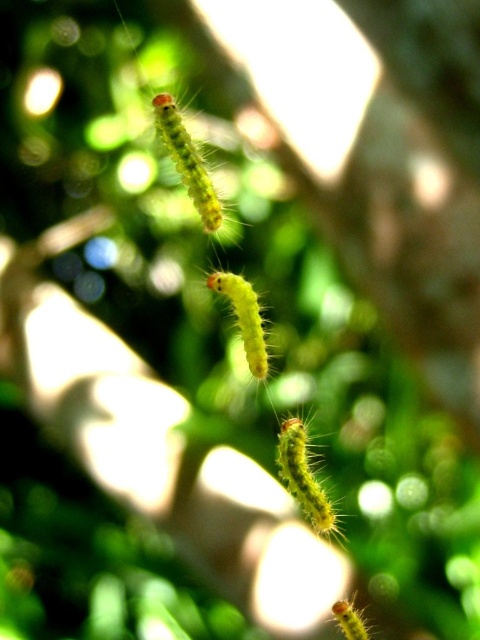
You are a bird looking for food. You see the yellow fuzzy caterpillar at center and the fuzzy yellow caterpillar at lower right. Which one is farther away from you?

The yellow fuzzy caterpillar at center is 27.55 inches away from the fuzzy yellow caterpillar at lower right. Since you are a bird observing from above, the distance between them doesn